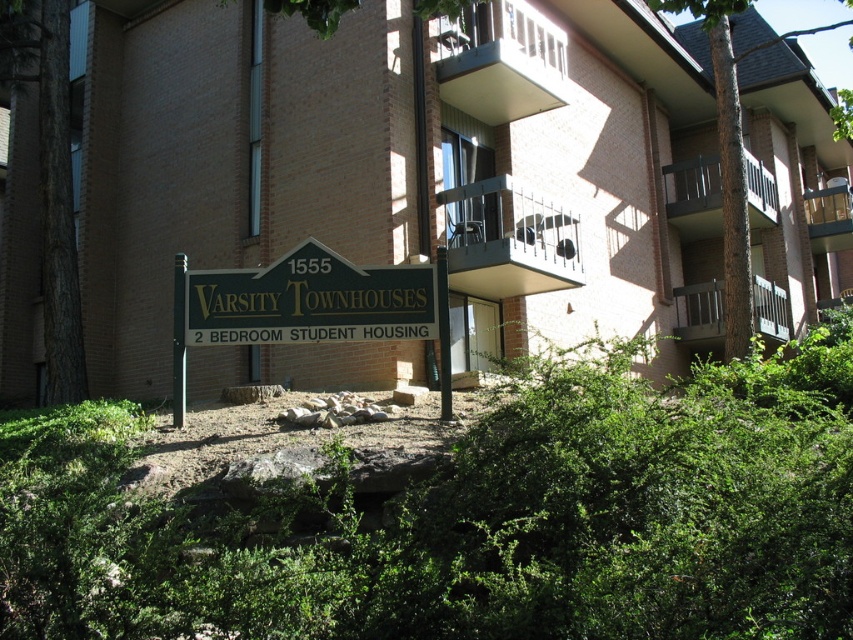
Question: Which of the following is the closest to the observer?

Choices:
 (A) (453, 244)
 (B) (727, 12)
 (C) (763, 284)

Answer: (B)

Question: Which point is farther from the camera taking this photo?

Choices:
 (A) (711, 193)
 (B) (763, 307)

Answer: (A)

Question: Is smooth concrete balcony at upper center bigger than dark gray wooden balcony at upper right?

Choices:
 (A) no
 (B) yes

Answer: (B)

Question: Is greenmaterial/texturesign at center thinner than brown textured tree at upper right?

Choices:
 (A) no
 (B) yes

Answer: (B)

Question: Observing the image, what is the correct spatial positioning of smooth concrete balcony at upper center in reference to metallic silver balcony at upper right?

Choices:
 (A) below
 (B) above

Answer: (B)

Question: Which point is farther to the camera?

Choices:
 (A) (488, 253)
 (B) (372, 314)
 (C) (816, 189)
 (D) (689, 288)

Answer: (C)